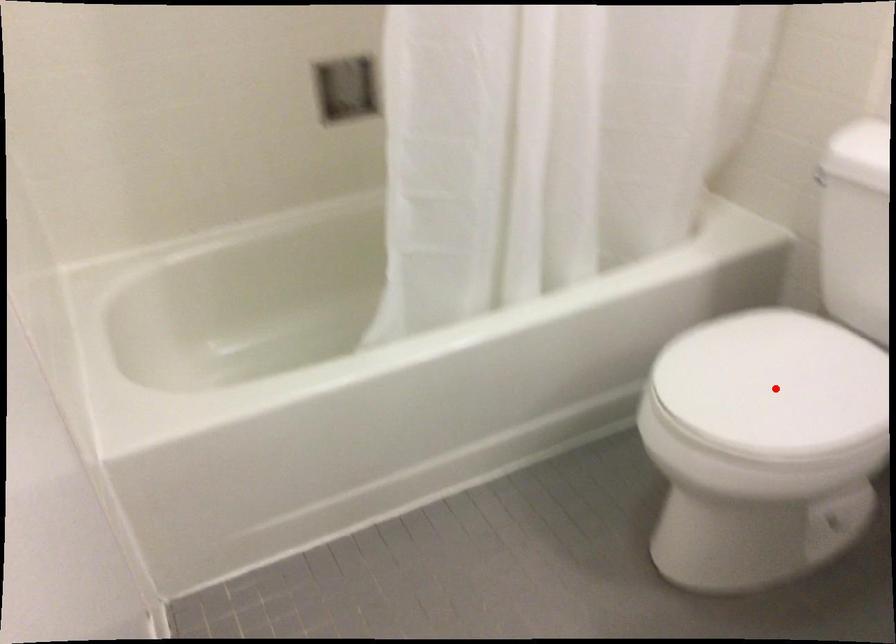
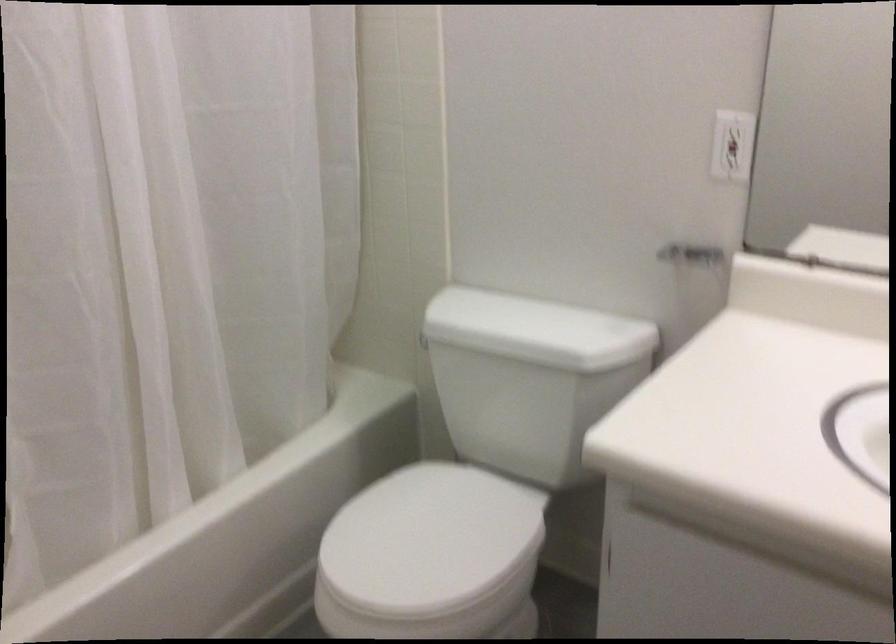
The point at the highlighted location is marked in the first image. Where is the corresponding point in the second image?

(429, 540)